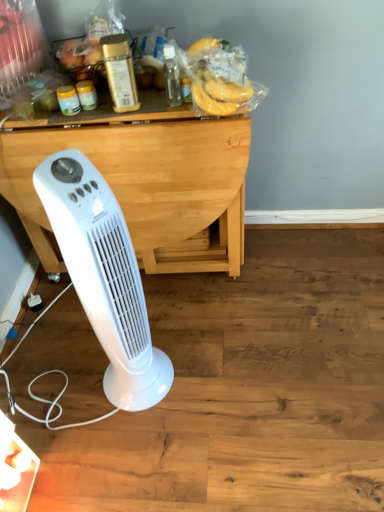
You are a GUI agent. You are given a task and a screenshot of the screen. Output one action in this format:
    pyautogui.click(x=<x>, y=<y>)
    Task: Click on the vacant area located to the right-hand side of wooden table at center
    This screenshot has height=512, width=384.
    Given the screenshot: What is the action you would take?
    295,284